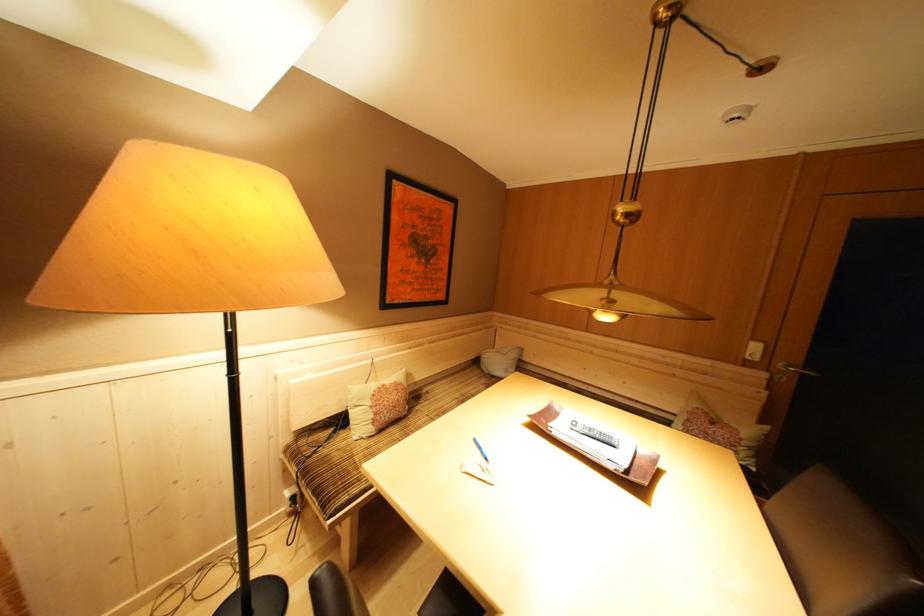
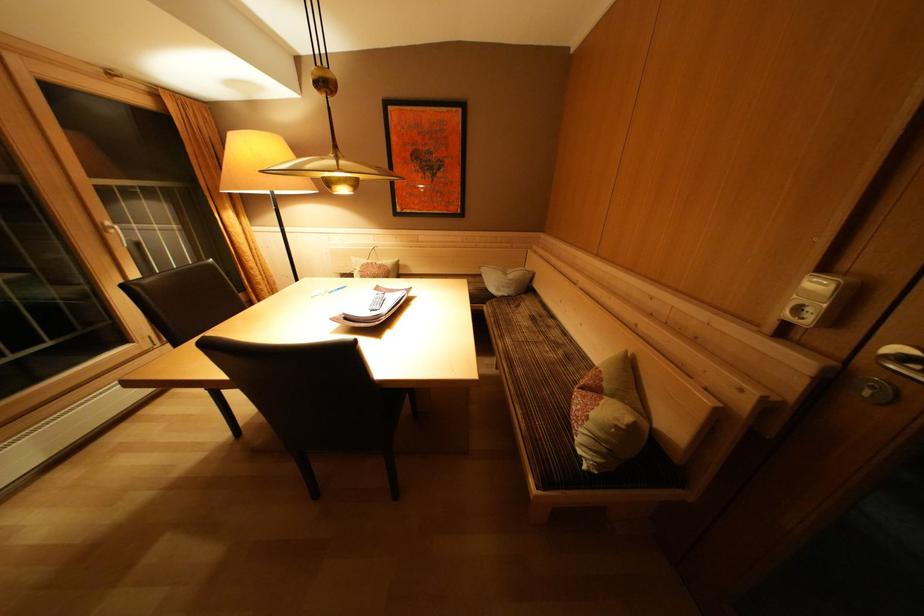
Where in the second image is the point corresponding to point (749, 440) from the first image?

(600, 419)